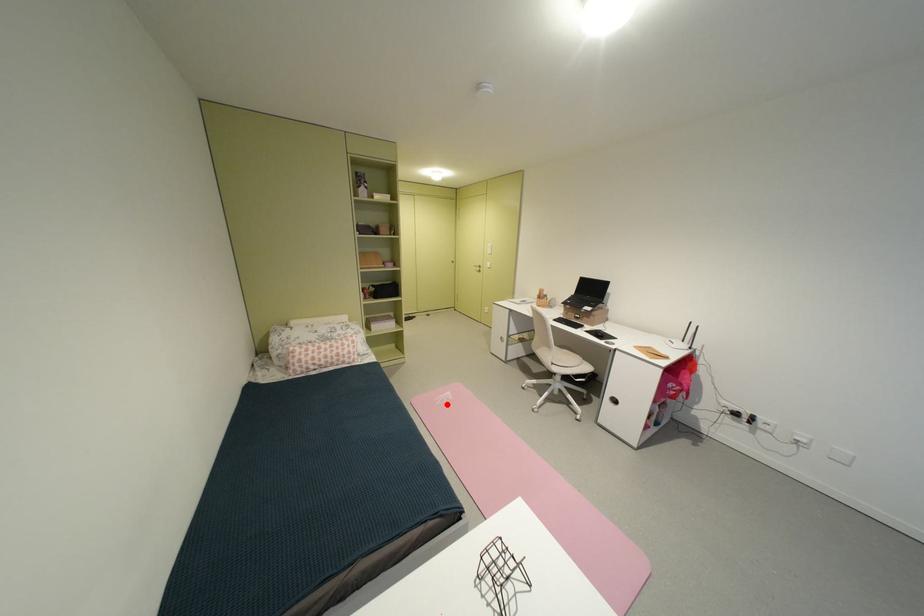
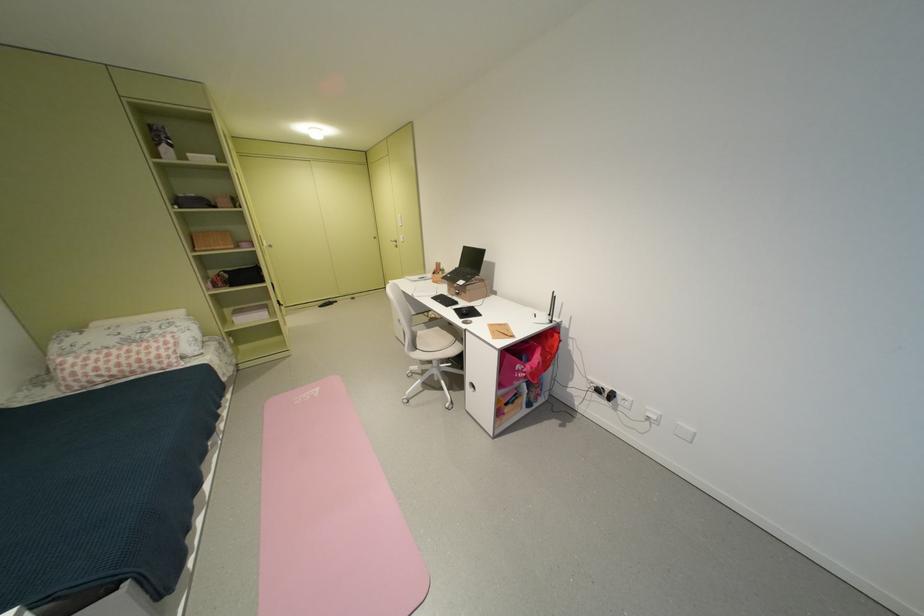
Where in the second image is the point corresponding to the highlighted location from the first image?

(305, 403)